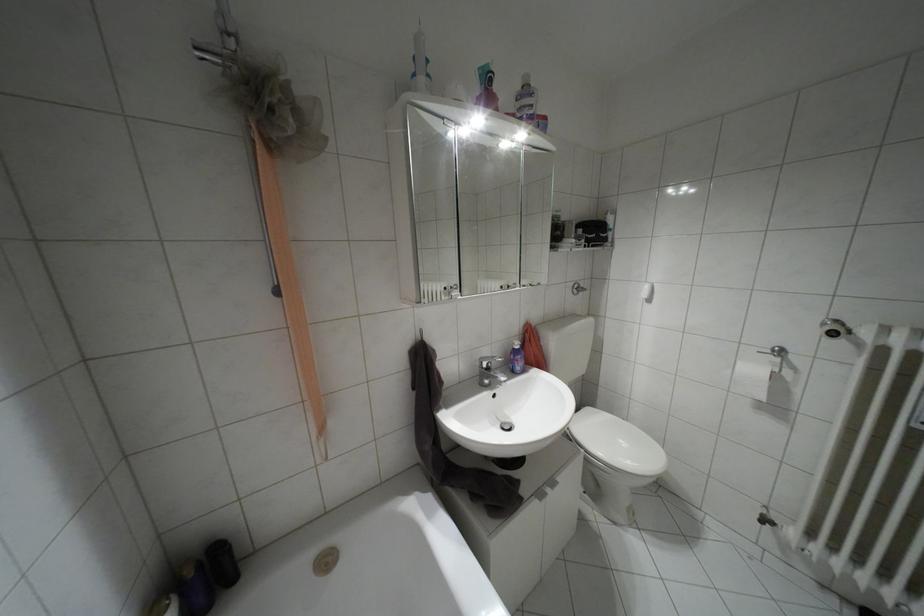
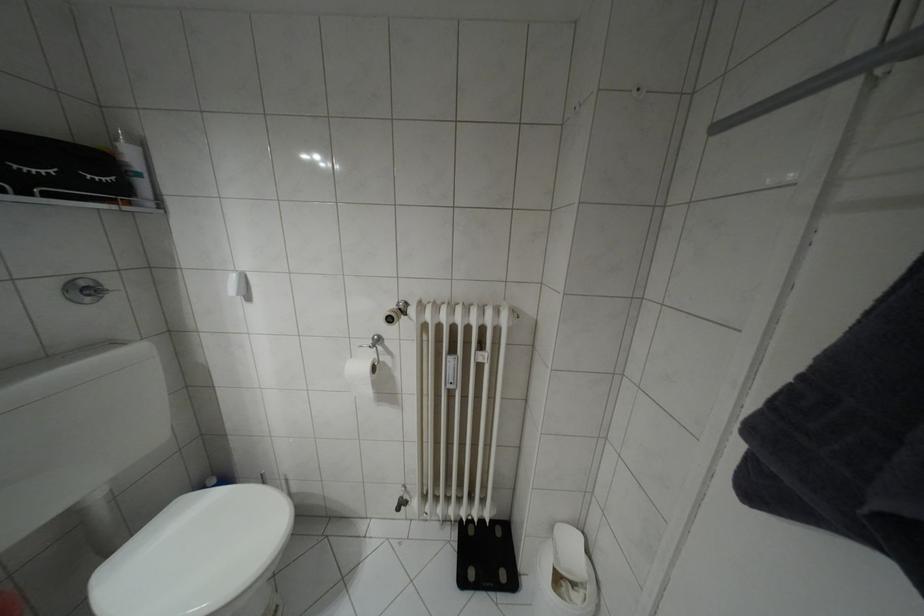
Where in the second image is the point corresponding to (x=591, y=246) from the first image?

(49, 195)